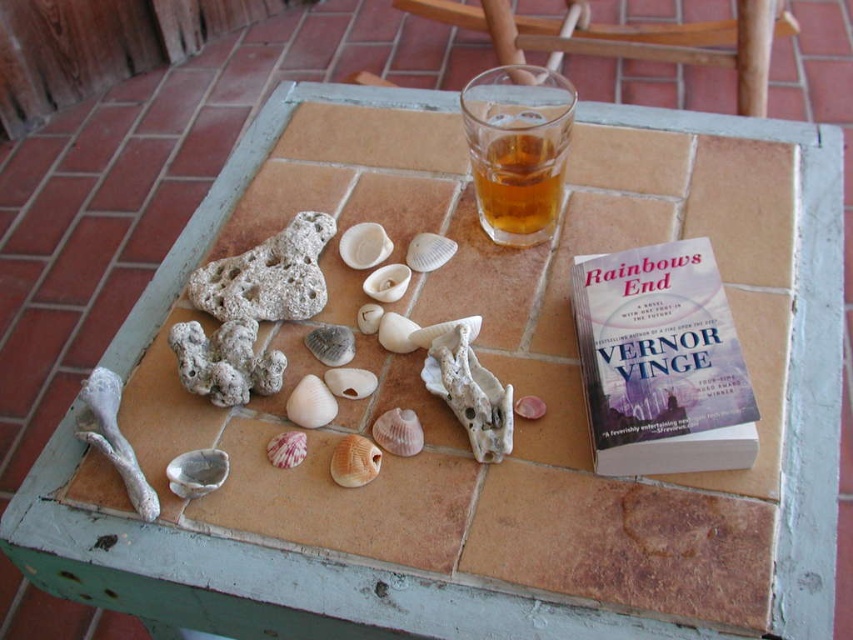
Question: Is the position of matte purple cover at upper right more distant than that of smooth beige shell at center?

Choices:
 (A) yes
 (B) no

Answer: (B)

Question: Which point is farther to the camera?

Choices:
 (A) smooth beige shell at center
 (B) matte purple cover at upper right

Answer: (A)

Question: Can you confirm if translucent glass at upper center is bigger than smooth beige shell at center?

Choices:
 (A) no
 (B) yes

Answer: (B)

Question: Does translucent glass at upper center appear under smooth beige shell at center?

Choices:
 (A) no
 (B) yes

Answer: (A)

Question: Which point is farther to the camera?

Choices:
 (A) (337, 483)
 (B) (486, 228)

Answer: (B)

Question: Which object is farther from the camera taking this photo?

Choices:
 (A) matte purple cover at upper right
 (B) translucent glass at upper center
 (C) smooth beige shell at center

Answer: (B)